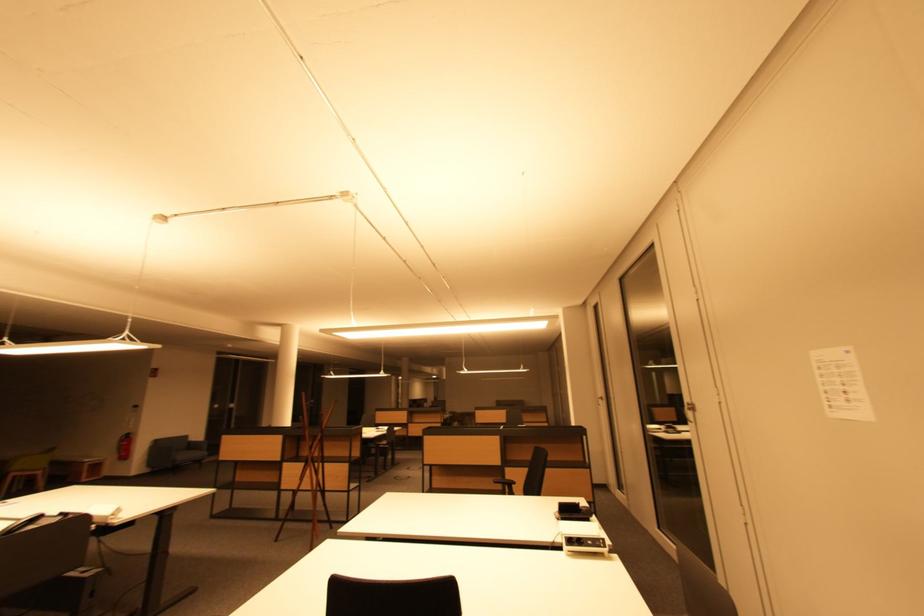
Identify the location of fire extinguisher handle. (124, 450).